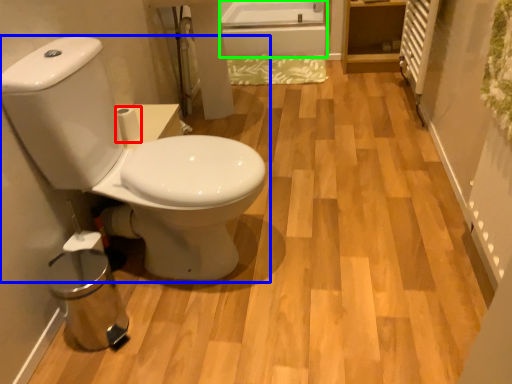
Question: Based on their relative distances, which object is nearer to toilet paper (highlighted by a red box)? Choose from toilet (highlighted by a blue box) and bath (highlighted by a green box).

Choices:
 (A) toilet
 (B) bath

Answer: (A)